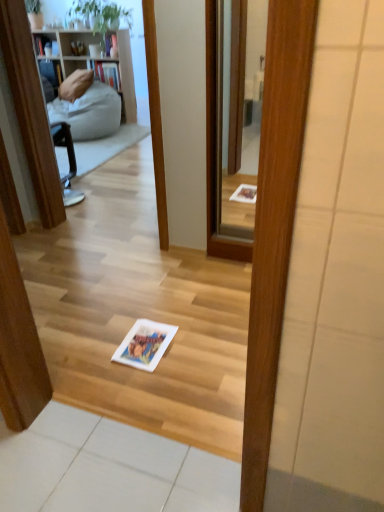
Where is `empty space that is to the right of white paper book at center`? This screenshot has width=384, height=512. empty space that is to the right of white paper book at center is located at coordinates (199, 347).